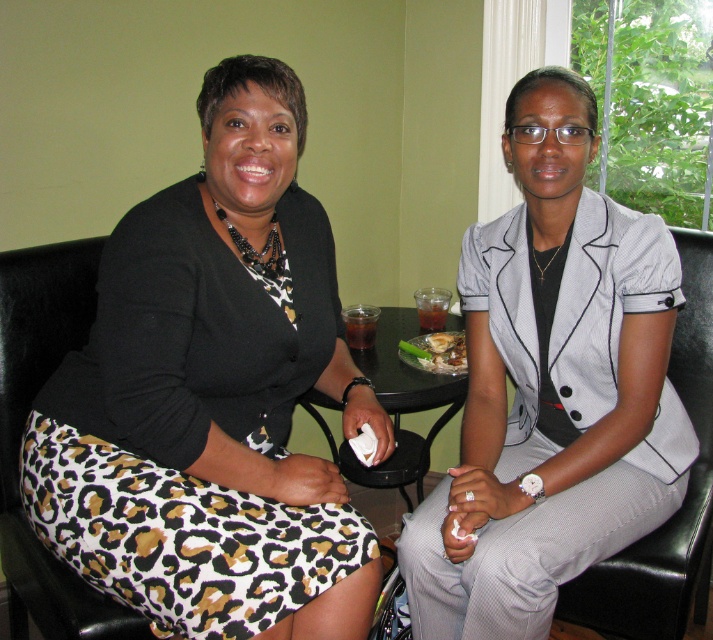
Locate an element on the screen. This screenshot has height=640, width=713. gray fabric armchair at right is located at coordinates (682, 500).

Between gray fabric armchair at right and black glass table at center, which one appears on the right side from the viewer's perspective?

From the viewer's perspective, gray fabric armchair at right appears more on the right side.

Where is `gray fabric armchair at right`? This screenshot has height=640, width=713. gray fabric armchair at right is located at coordinates (682, 500).

Is leopard print skirt at lower left wider than translucent glass cup at center?

Yes.

Can you confirm if leopard print skirt at lower left is smaller than translucent glass cup at center?

Actually, leopard print skirt at lower left might be larger than translucent glass cup at center.

Between point (58, 248) and point (434, 307), which one is positioned behind?

Point (434, 307)

Locate an element on the screen. leopard print skirt at lower left is located at coordinates (24, 426).

In the scene shown: Is leopard print skirt at left to the right of translucent glass at table center from the viewer's perspective?

No, leopard print skirt at left is not to the right of translucent glass at table center.

Between leopard print skirt at left and translucent glass at table center, which one has more height?

leopard print skirt at left is taller.

The width and height of the screenshot is (713, 640). I want to click on leopard print skirt at left, so click(x=212, y=396).

The height and width of the screenshot is (640, 713). Identify the location of leopard print skirt at left. (212, 396).